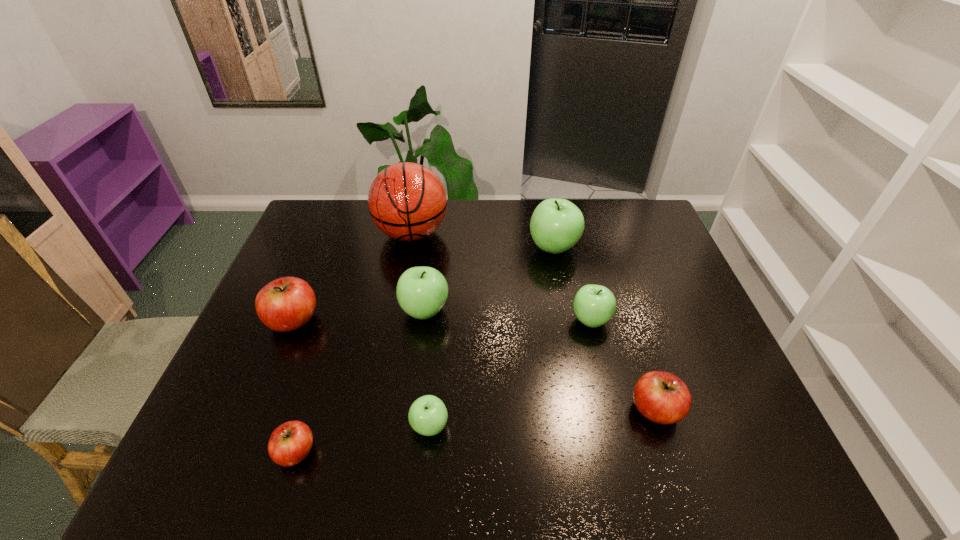
Select which apple appears as the second closest to the second red apple from left to right. Please provide its 2D coordinates. Your answer should be formatted as a tuple, i.e. [(x, y)], where the tuple contains the x and y coordinates of a point satisfying the conditions above.

[(285, 304)]

Where is `the third closest apple to the second red apple from right to left`? Image resolution: width=960 pixels, height=540 pixels. the third closest apple to the second red apple from right to left is located at coordinates (421, 292).

Identify which green apple is the third nearest to the leftmost red apple. Please provide its 2D coordinates. Your answer should be formatted as a tuple, i.e. [(x, y)], where the tuple contains the x and y coordinates of a point satisfying the conditions above.

[(556, 225)]

In order to click on green apple that is the second closest to the third biggest green apple in this screenshot , I will do `click(421, 292)`.

Identify which red apple is the second closest to the smallest red apple. Please provide its 2D coordinates. Your answer should be formatted as a tuple, i.e. [(x, y)], where the tuple contains the x and y coordinates of a point satisfying the conditions above.

[(663, 398)]

The image size is (960, 540). I want to click on red apple that is the second closest to the leftmost object, so click(x=663, y=398).

This screenshot has height=540, width=960. I want to click on vacant space that satisfies the following two spatial constraints: 1. on the side with spill of the second smallest green apple; 2. on the left side of the tallest object, so click(x=396, y=320).

Where is `free space that satisfies the following two spatial constraints: 1. on the side with spill of the tallest object; 2. on the left side of the second smallest red apple`? free space that satisfies the following two spatial constraints: 1. on the side with spill of the tallest object; 2. on the left side of the second smallest red apple is located at coordinates (379, 410).

The width and height of the screenshot is (960, 540). I want to click on vacant space that satisfies the following two spatial constraints: 1. on the side with spill of the tallest object; 2. on the right side of the second biggest red apple, so click(x=379, y=410).

Locate an element on the screen. free space that satisfies the following two spatial constraints: 1. on the side with spill of the basketball; 2. on the right side of the third biggest green apple is located at coordinates (396, 320).